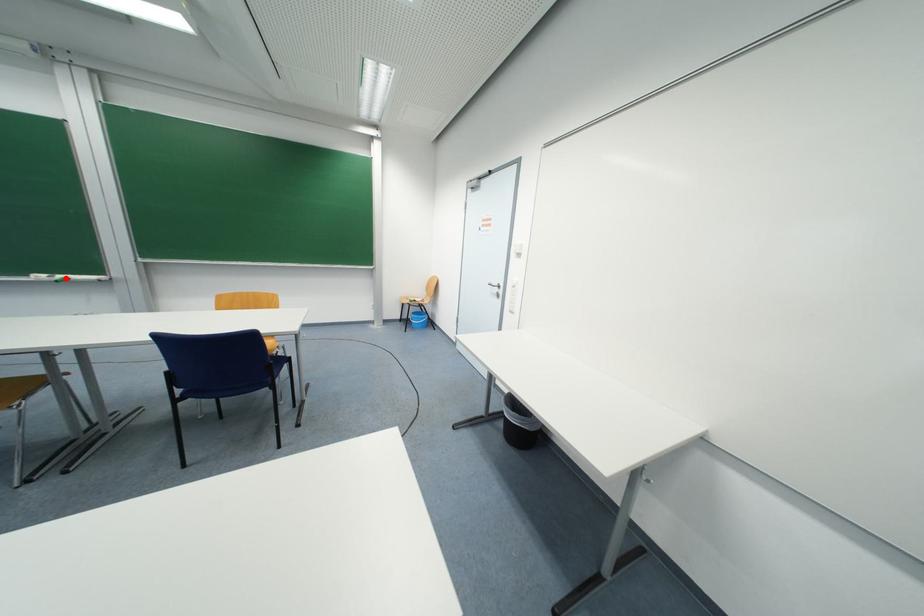
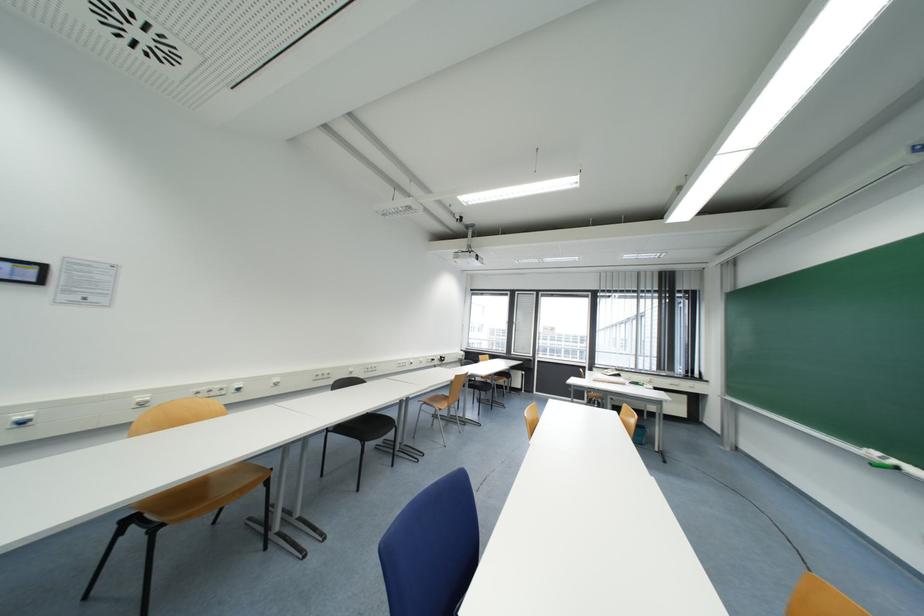
Question: A red point is marked in image1. In image2, is the corresponding 3D point closer to the camera or farther? Reply with the corresponding letter.

Choices:
 (A) The corresponding 3D point is closer.
 (B) The corresponding 3D point is farther.

Answer: (A)